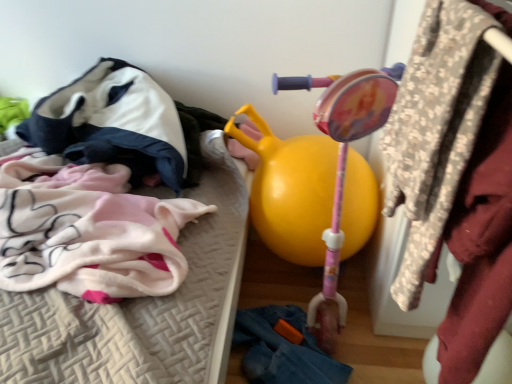
You are a GUI agent. You are given a task and a screenshot of the screen. Output one action in this format:
    pyautogui.click(x=<x>, y=<y>)
    Task: Click on the floral fabric coat at upper right
    The width and height of the screenshot is (512, 384).
    Given the screenshot: What is the action you would take?
    pyautogui.click(x=456, y=175)

The width and height of the screenshot is (512, 384). What do you see at coordinates (214, 253) in the screenshot?
I see `soft pink fabric blanket at left` at bounding box center [214, 253].

The width and height of the screenshot is (512, 384). I want to click on yellow rubber ball at center, so click(290, 190).

What do you see at coordinates (112, 123) in the screenshot? The height and width of the screenshot is (384, 512). I see `velvet-like hoodie at upper left, arranged as the second clothing when viewed from the right` at bounding box center [112, 123].

Find the location of a particular element. The image size is (512, 384). floral fabric coat at upper right is located at coordinates (456, 175).

Based on their sizes in the image, would you say velvet-like hoodie at upper left, arranged as the second clothing when viewed from the right, is bigger or smaller than yellow rubber ball at center?

Clearly, velvet-like hoodie at upper left, arranged as the second clothing when viewed from the right, is larger in size than yellow rubber ball at center.

Relative to yellow rubber ball at center, is velvet-like hoodie at upper left, the 2th clothing from the bottom, in front or behind?

Clearly, velvet-like hoodie at upper left, the 2th clothing from the bottom, is behind yellow rubber ball at center.

Is velvet-like hoodie at upper left, the first clothing viewed from the left, facing towards yellow rubber ball at center?

No, velvet-like hoodie at upper left, the first clothing viewed from the left, is not facing towards yellow rubber ball at center.

Which of these two, denim at lower right, arranged as the second clothing when viewed from the left, or floral fabric coat at upper right, is bigger?

Bigger between the two is floral fabric coat at upper right.

Can you tell me how much denim at lower right, arranged as the second clothing when viewed from the left, and floral fabric coat at upper right differ in facing direction?

The angular difference between denim at lower right, arranged as the second clothing when viewed from the left, and floral fabric coat at upper right is 6.67e-06 degrees.

Is denim at lower right, arranged as the second clothing when viewed from the left, spatially inside floral fabric coat at upper right, or outside of it?

The correct answer is: outside.

Can you confirm if denim at lower right, which is the second clothing from top to bottom, is positioned to the left of floral fabric coat at upper right?

Correct, you'll find denim at lower right, which is the second clothing from top to bottom, to the left of floral fabric coat at upper right.

Relative to soft pink fabric blanket at left, is yellow rubber ball at center in front or behind?

Clearly, yellow rubber ball at center is behind soft pink fabric blanket at left.

Does yellow rubber ball at center have a smaller size compared to soft pink fabric blanket at left?

Yes, yellow rubber ball at center is smaller than soft pink fabric blanket at left.

Where is `toy to the right of soft pink fabric blanket at left`? The image size is (512, 384). toy to the right of soft pink fabric blanket at left is located at coordinates (290, 190).

Does yellow rubber ball at center turn towards soft pink fabric blanket at left?

No, yellow rubber ball at center is not facing towards soft pink fabric blanket at left.

Considering the relative positions of floral fabric coat at upper right and soft pink fabric blanket at left in the image provided, is floral fabric coat at upper right to the left of soft pink fabric blanket at left from the viewer's perspective?

Incorrect, floral fabric coat at upper right is not on the left side of soft pink fabric blanket at left.

Looking at this image, is floral fabric coat at upper right bigger than soft pink fabric blanket at left?

Actually, floral fabric coat at upper right might be smaller than soft pink fabric blanket at left.

Who is taller, floral fabric coat at upper right or soft pink fabric blanket at left?

With more height is floral fabric coat at upper right.

From a real-world perspective, is floral fabric coat at upper right positioned above or below soft pink fabric blanket at left?

Clearly, from a real-world perspective, floral fabric coat at upper right is above soft pink fabric blanket at left.

Considering the positions of objects soft pink fabric blanket at left and denim at lower right, which is the second clothing from top to bottom, in the image provided, who is more to the right, soft pink fabric blanket at left or denim at lower right, which is the second clothing from top to bottom,?

denim at lower right, which is the second clothing from top to bottom, is more to the right.

In terms of width, does soft pink fabric blanket at left look wider or thinner when compared to denim at lower right, which is the second clothing from top to bottom?

In the image, soft pink fabric blanket at left appears to be wider than denim at lower right, which is the second clothing from top to bottom.

In terms of height, does soft pink fabric blanket at left look taller or shorter compared to denim at lower right, placed as the 1th clothing when sorted from bottom to top?

Clearly, soft pink fabric blanket at left is taller compared to denim at lower right, placed as the 1th clothing when sorted from bottom to top.

Can we say soft pink fabric blanket at left lies outside denim at lower right, arranged as the second clothing when viewed from the left?

Indeed, soft pink fabric blanket at left is completely outside denim at lower right, arranged as the second clothing when viewed from the left.

Which object is positioned more to the left, yellow rubber ball at center or velvet-like hoodie at upper left, which appears as the 1th clothing when viewed from the top?

velvet-like hoodie at upper left, which appears as the 1th clothing when viewed from the top, is more to the left.

Based on the photo, from the image's perspective, is yellow rubber ball at center located above or below velvet-like hoodie at upper left, arranged as the second clothing when viewed from the right?

Based on their image positions, yellow rubber ball at center is located beneath velvet-like hoodie at upper left, arranged as the second clothing when viewed from the right.

Is point (296, 218) farther from viewer compared to point (53, 98)?

That is False.

Is yellow rubber ball at center looking in the opposite direction of velvet-like hoodie at upper left, the first clothing viewed from the left?

No.

Who is taller, yellow rubber ball at center or floral fabric coat at upper right?

With more height is floral fabric coat at upper right.

Measure the distance from yellow rubber ball at center to floral fabric coat at upper right.

yellow rubber ball at center is 19.88 inches from floral fabric coat at upper right.

What's the angular difference between yellow rubber ball at center and floral fabric coat at upper right's facing directions?

The angular difference between yellow rubber ball at center and floral fabric coat at upper right is 1.78e-05 degrees.

From a real-world perspective, is yellow rubber ball at center below floral fabric coat at upper right?

Indeed, from a real-world perspective, yellow rubber ball at center is positioned beneath floral fabric coat at upper right.

Locate an element on the screen. Image resolution: width=512 pixels, height=384 pixels. clothing above the yellow rubber ball at center (from the image's perspective) is located at coordinates (112, 123).

This screenshot has width=512, height=384. What are the coordinates of `closet on the right of the denim at lower right, which is the second clothing from top to bottom` in the screenshot? It's located at (456, 175).

From the image, which object appears to be farther from denim at lower right, arranged as the first clothing when viewed from the right, yellow rubber ball at center or velvet-like hoodie at upper left, the first clothing viewed from the left?

velvet-like hoodie at upper left, the first clothing viewed from the left.

Estimate the real-world distances between objects in this image. Which object is further from yellow rubber ball at center, velvet-like hoodie at upper left, the first clothing viewed from the left, or floral fabric coat at upper right?

floral fabric coat at upper right is positioned further to the anchor yellow rubber ball at center.

From the image, which object appears to be nearer to floral fabric coat at upper right, soft pink fabric blanket at left or yellow rubber ball at center?

yellow rubber ball at center.

When comparing their distances from floral fabric coat at upper right, does denim at lower right, arranged as the second clothing when viewed from the left, or velvet-like hoodie at upper left, which appears as the 1th clothing when viewed from the top, seem closer?

denim at lower right, arranged as the second clothing when viewed from the left, lies closer to floral fabric coat at upper right than the other object.

Based on their spatial positions, is floral fabric coat at upper right or velvet-like hoodie at upper left, arranged as the second clothing when viewed from the right, further from yellow rubber ball at center?

floral fabric coat at upper right lies further to yellow rubber ball at center than the other object.

When comparing their distances from yellow rubber ball at center, does velvet-like hoodie at upper left, the 2th clothing from the bottom, or soft pink fabric blanket at left seem closer?

soft pink fabric blanket at left.

Estimate the real-world distances between objects in this image. Which object is closer to yellow rubber ball at center, soft pink fabric blanket at left or floral fabric coat at upper right?

The object closer to yellow rubber ball at center is soft pink fabric blanket at left.

Based on their spatial positions, is denim at lower right, arranged as the second clothing when viewed from the left, or yellow rubber ball at center closer to soft pink fabric blanket at left?

yellow rubber ball at center lies closer to soft pink fabric blanket at left than the other object.

This screenshot has height=384, width=512. In order to click on toy between floral fabric coat at upper right and velvet-like hoodie at upper left, the first clothing viewed from the left, along the z-axis in this screenshot , I will do `click(290, 190)`.

What are the coordinates of `furniture between velvet-like hoodie at upper left, the first clothing viewed from the left, and denim at lower right, arranged as the first clothing when viewed from the right, in the up-down direction` in the screenshot? It's located at (214, 253).

The image size is (512, 384). I want to click on toy that lies between velvet-like hoodie at upper left, the 2th clothing from the bottom, and denim at lower right, arranged as the first clothing when viewed from the right, from top to bottom, so click(290, 190).

Identify the location of toy between floral fabric coat at upper right and denim at lower right, arranged as the first clothing when viewed from the right, in the front-back direction. (290, 190).